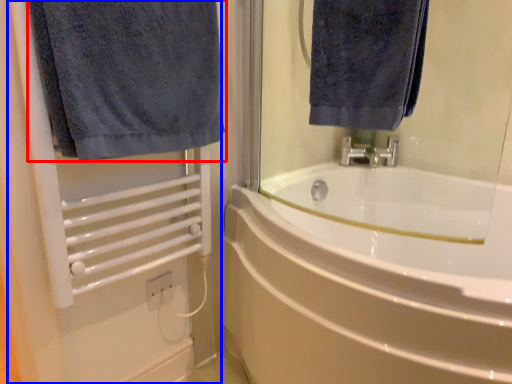
Question: Among these objects, which one is farthest to the camera, towel (highlighted by a red box) or screen door (highlighted by a blue box)?

Choices:
 (A) towel
 (B) screen door

Answer: (B)